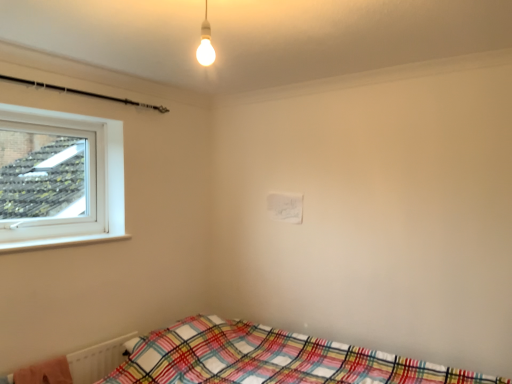
Question: From the image's perspective, is plaid fabric bed at lower right located above or below plaid fabric blanket at lower left?

Choices:
 (A) above
 (B) below

Answer: (B)

Question: Considering their positions, is plaid fabric bed at lower right located in front of or behind plaid fabric blanket at lower left?

Choices:
 (A) behind
 (B) front

Answer: (B)

Question: Which object is positioned closest to the plaid fabric bed at lower right?

Choices:
 (A) matte white bulb at upper center
 (B) plaid fabric blanket at lower left

Answer: (B)

Question: Which of these objects is positioned closest to the plaid fabric blanket at lower left?

Choices:
 (A) matte white bulb at upper center
 (B) plaid fabric bed at lower right

Answer: (B)